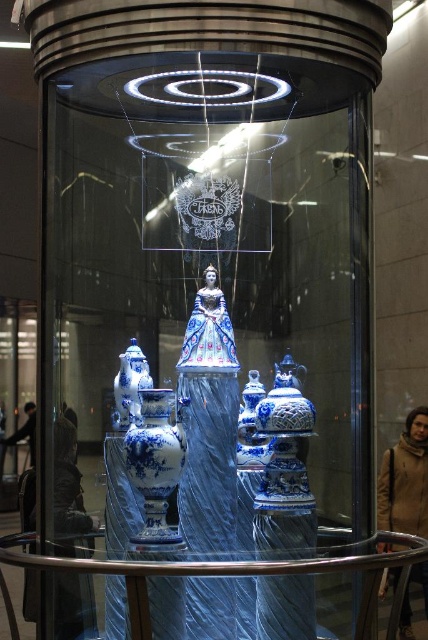
Find the location of `transparent plastic table at center`. transparent plastic table at center is located at coordinates (237, 572).

Does transparent plastic table at center appear on the right side of blue porcelain vase at center?

Indeed, transparent plastic table at center is positioned on the right side of blue porcelain vase at center.

Is point (228, 572) positioned behind point (172, 461)?

No, (228, 572) is in front of (172, 461).

The height and width of the screenshot is (640, 428). In order to click on transparent plastic table at center in this screenshot , I will do `click(237, 572)`.

What do you see at coordinates (237, 572) in the screenshot? I see `transparent plastic table at center` at bounding box center [237, 572].

At what (x,y) coordinates should I click in order to perform the action: click on transparent plastic table at center. Please return your answer as a coordinate pair (x, y). Looking at the image, I should click on (237, 572).

The height and width of the screenshot is (640, 428). What do you see at coordinates (237, 572) in the screenshot?
I see `transparent plastic table at center` at bounding box center [237, 572].

Locate an element on the screen. The width and height of the screenshot is (428, 640). transparent plastic table at center is located at coordinates (237, 572).

Who is lower down, blue porcelain vase at center or blue glazed porcelain vase at left?

blue porcelain vase at center is below.

Does blue porcelain vase at center have a lesser height compared to blue glazed porcelain vase at left?

Incorrect, blue porcelain vase at center's height does not fall short of blue glazed porcelain vase at left's.

What do you see at coordinates (155, 461) in the screenshot?
I see `blue porcelain vase at center` at bounding box center [155, 461].

You are a GUI agent. You are given a task and a screenshot of the screen. Output one action in this format:
    pyautogui.click(x=<x>, y=<y>)
    Task: Click on the blue porcelain vase at center
    The width and height of the screenshot is (428, 640).
    Given the screenshot: What is the action you would take?
    pyautogui.click(x=155, y=461)